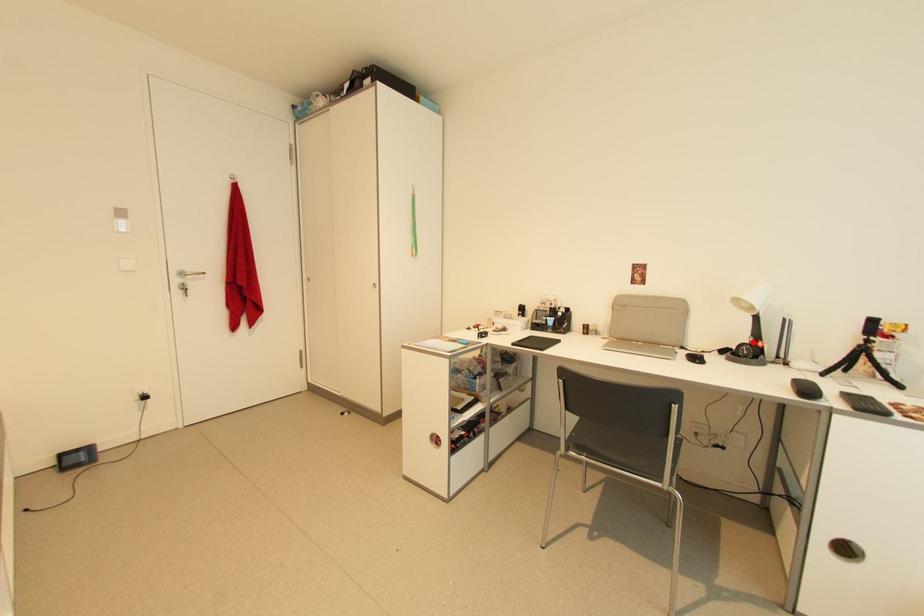
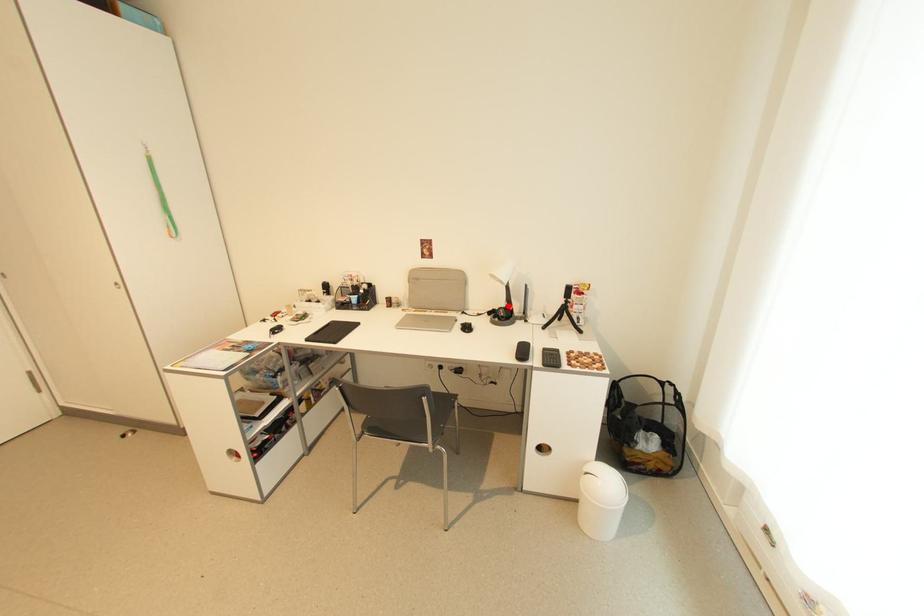
I am providing you with two images of the same scene from different viewpoints. A red point is marked on the first image and another point is marked on the second image. Are the points marked in image1 and image2 representing the same 3D position?

Yes